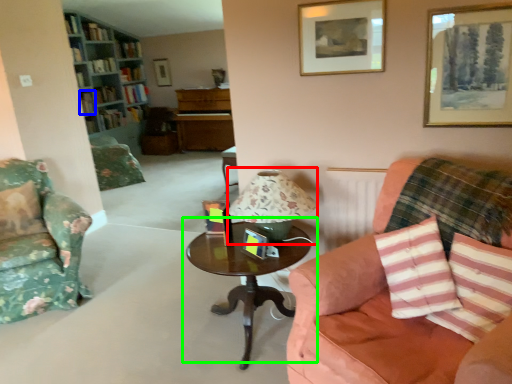
Question: Which object is the farthest from table lamp (highlighted by a red box)? Choose among these: book (highlighted by a blue box) or coffee table (highlighted by a green box).

Choices:
 (A) book
 (B) coffee table

Answer: (A)